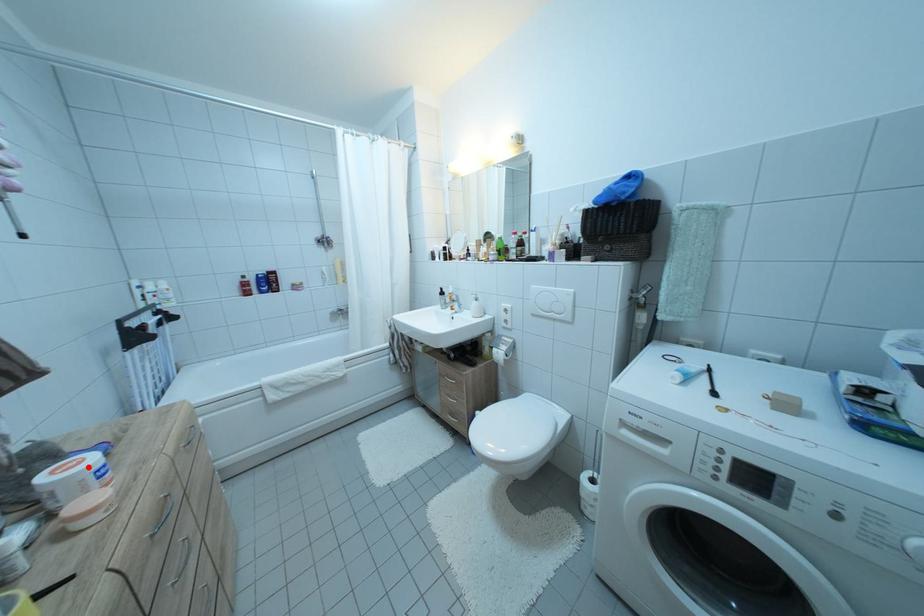
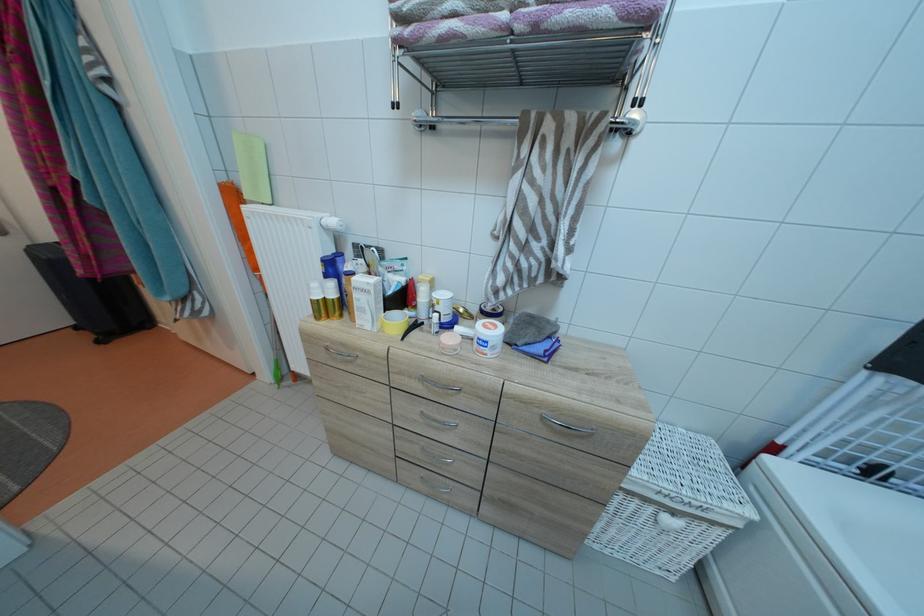
Locate, in the second image, the point that corresponds to the highlighted location in the first image.

(496, 334)